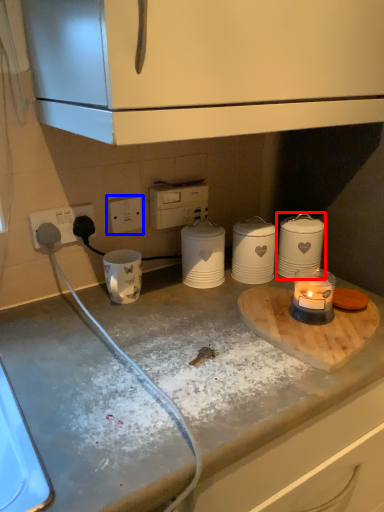
Question: Among these objects, which one is nearest to the camera, kitchen appliance (highlighted by a red box) or electric outlet (highlighted by a blue box)?

Choices:
 (A) kitchen appliance
 (B) electric outlet

Answer: (B)